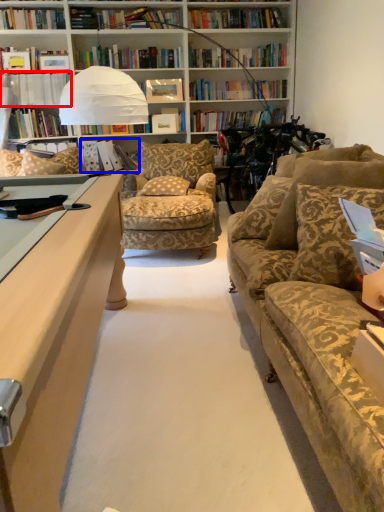
Question: Among these objects, which one is farthest to the camera, book (highlighted by a red box) or book (highlighted by a blue box)?

Choices:
 (A) book
 (B) book

Answer: (B)